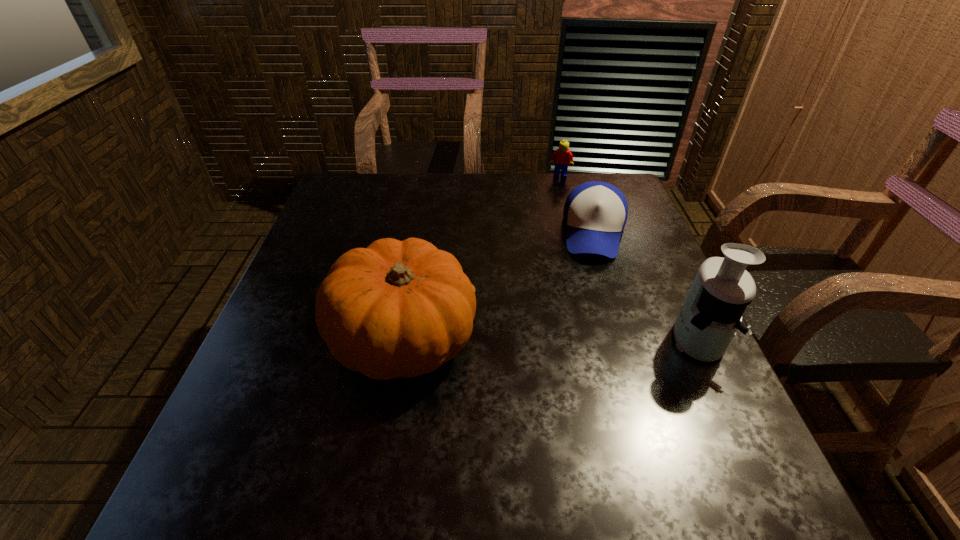
This screenshot has height=540, width=960. I want to click on vacant position located on the front-facing side of the second farthest object, so click(586, 395).

Where is `free space located 0.060m on the front-facing side of the second farthest object`? The height and width of the screenshot is (540, 960). free space located 0.060m on the front-facing side of the second farthest object is located at coordinates (596, 278).

The width and height of the screenshot is (960, 540). In order to click on free space located on the front-facing side of the second farthest object in this screenshot , I will do `click(588, 369)`.

In order to click on Lego at the far edge in this screenshot , I will do `click(562, 157)`.

Find the location of `baseball cap that is at the far edge`. baseball cap that is at the far edge is located at coordinates (595, 213).

Locate an element on the screen. object at the near edge is located at coordinates (395, 309).

Where is `object at the left edge`? The height and width of the screenshot is (540, 960). object at the left edge is located at coordinates (395, 309).

The height and width of the screenshot is (540, 960). I want to click on juicer that is at the right edge, so click(712, 312).

The width and height of the screenshot is (960, 540). I want to click on Lego positioned at the right edge, so click(562, 157).

The width and height of the screenshot is (960, 540). I want to click on baseball cap that is positioned at the right edge, so click(595, 213).